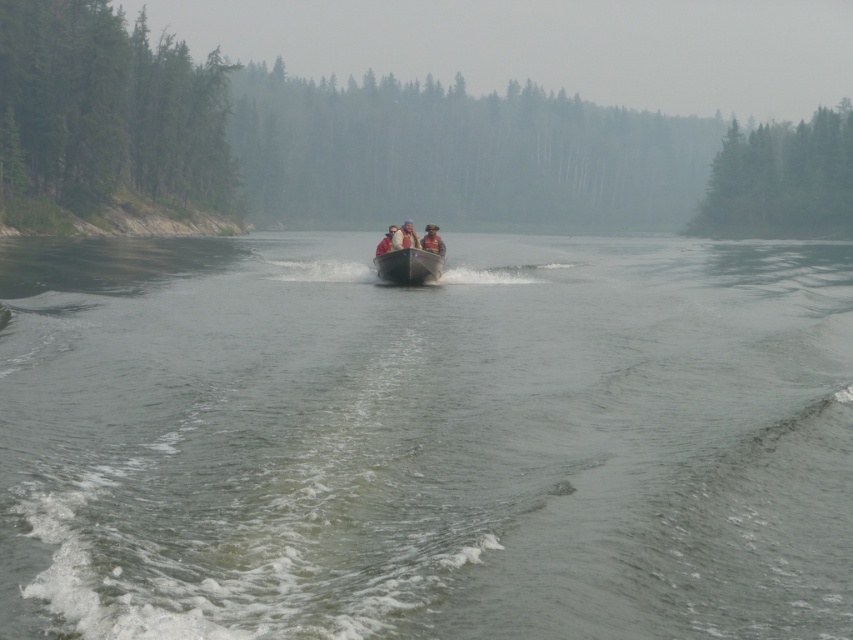
Question: Which of the following is the closest to the observer?

Choices:
 (A) metallic gray boat at center
 (B) clear water at center
 (C) light brown leather jacket at center

Answer: (B)

Question: Can you confirm if green matte trees at center is positioned to the right of green matte tree at left?

Choices:
 (A) yes
 (B) no

Answer: (A)

Question: Which object appears farthest from the camera in this image?

Choices:
 (A) clear water at center
 (B) orange life vest at center
 (C) metallic gray boat at center

Answer: (B)

Question: Where is green matte trees at center located in relation to matte pink life vest at center in the image?

Choices:
 (A) left
 (B) right

Answer: (A)

Question: From the image, what is the correct spatial relationship of green matte trees at upper center in relation to matte pink life vest at center?

Choices:
 (A) left
 (B) right

Answer: (B)

Question: Which of the following is the farthest from the observer?

Choices:
 (A) (407, 244)
 (B) (486, 308)
 (C) (392, 225)

Answer: (C)